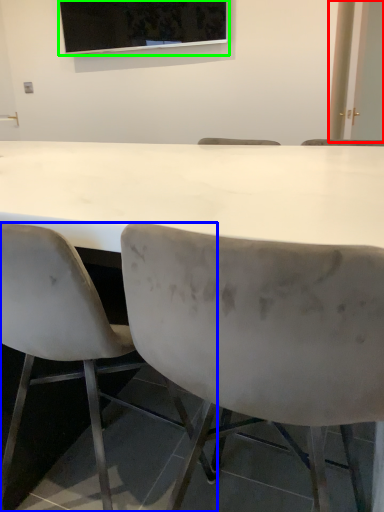
Question: Which object is positioned closest to glass door (highlighted by a red box)? Select from chair (highlighted by a blue box) and projection screen (highlighted by a green box).

Choices:
 (A) chair
 (B) projection screen

Answer: (B)